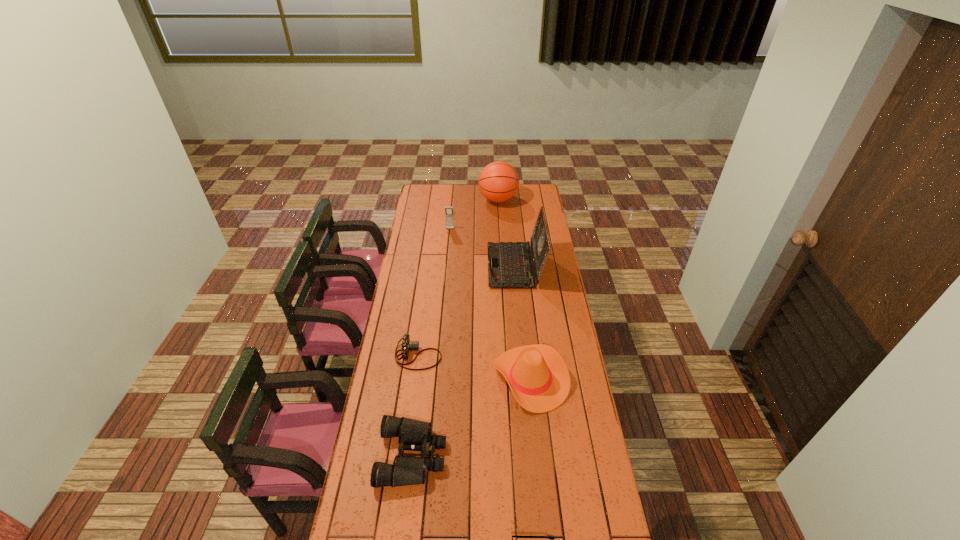
I want to click on vacant space located 0.360m on the left of the farthest object, so click(423, 200).

Identify the location of vacant region located on the front-facing side of the cellular telephone. (447, 258).

This screenshot has width=960, height=540. I want to click on free spot located on the back of the cowboy hat, so click(521, 290).

Locate an element on the screen. The height and width of the screenshot is (540, 960). free region located through the eyepieces of the sixth farthest object is located at coordinates (477, 456).

Locate an element on the screen. The image size is (960, 540). vacant region located on the front-facing side of the sixth tallest object is located at coordinates (535, 355).

Locate an element on the screen. This screenshot has width=960, height=540. object located at the far edge is located at coordinates (498, 182).

Find the location of a particular element. Image resolution: width=960 pixels, height=540 pixels. binoculars at the left edge is located at coordinates (414, 435).

Locate an element on the screen. The image size is (960, 540). camera positioned at the left edge is located at coordinates (407, 345).

Locate an element on the screen. The height and width of the screenshot is (540, 960). laptop computer that is at the right edge is located at coordinates (510, 265).

Where is `cowboy hat positioned at the right edge`? The width and height of the screenshot is (960, 540). cowboy hat positioned at the right edge is located at coordinates (538, 377).